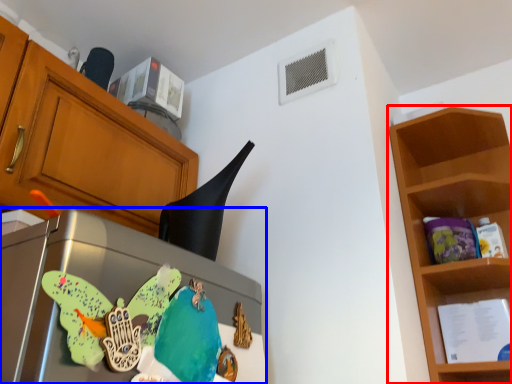
Question: Among these objects, which one is nearest to the camera, shelf (highlighted by a red box) or appliance (highlighted by a blue box)?

Choices:
 (A) shelf
 (B) appliance

Answer: (B)